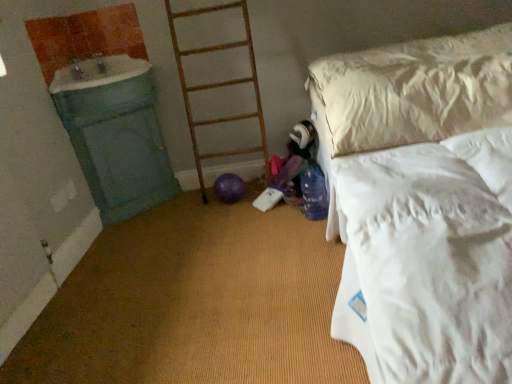
Question: Considering the relative positions of green painted wood sink at left and white soft bed at right in the image provided, is green painted wood sink at left to the right of white soft bed at right from the viewer's perspective?

Choices:
 (A) no
 (B) yes

Answer: (A)

Question: Is the position of green painted wood sink at left less distant than that of white soft bed at right?

Choices:
 (A) yes
 (B) no

Answer: (B)

Question: Can you confirm if green painted wood sink at left is thinner than white soft bed at right?

Choices:
 (A) yes
 (B) no

Answer: (A)

Question: Is green painted wood sink at left aimed at white soft bed at right?

Choices:
 (A) yes
 (B) no

Answer: (B)

Question: Does green painted wood sink at left have a lesser height compared to white soft bed at right?

Choices:
 (A) no
 (B) yes

Answer: (B)

Question: From a real-world perspective, is green painted wood sink at left physically above white soft bed at right?

Choices:
 (A) no
 (B) yes

Answer: (B)

Question: Is green painted wood sink at left facing away from wooden ladder at center?

Choices:
 (A) no
 (B) yes

Answer: (A)

Question: Can you confirm if green painted wood sink at left is smaller than wooden ladder at center?

Choices:
 (A) yes
 (B) no

Answer: (A)

Question: Is the position of green painted wood sink at left more distant than that of wooden ladder at center?

Choices:
 (A) no
 (B) yes

Answer: (A)

Question: From the image's perspective, would you say green painted wood sink at left is shown under wooden ladder at center?

Choices:
 (A) no
 (B) yes

Answer: (A)

Question: Does green painted wood sink at left have a lesser height compared to wooden ladder at center?

Choices:
 (A) no
 (B) yes

Answer: (B)

Question: Does green painted wood sink at left appear on the right side of wooden ladder at center?

Choices:
 (A) yes
 (B) no

Answer: (B)

Question: Does wooden ladder at center have a lesser height compared to green painted wood sink at left?

Choices:
 (A) yes
 (B) no

Answer: (B)